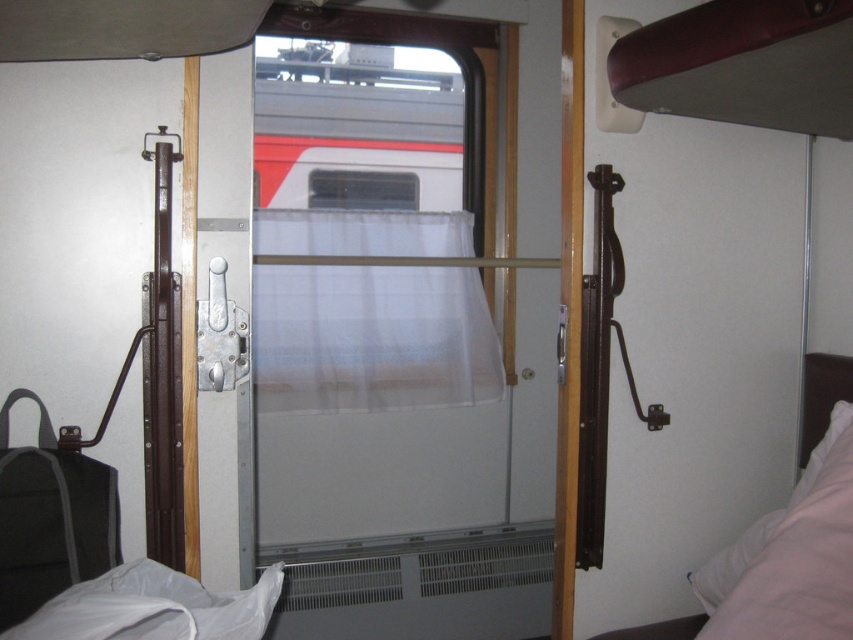
Between point (746, 588) and point (819, 365), which one is positioned behind?

Point (819, 365)

In the scene shown: Is white soft pillow at lower right to the right of white soft bed at right from the viewer's perspective?

Incorrect, white soft pillow at lower right is not on the right side of white soft bed at right.

Which is in front, point (837, 570) or point (804, 440)?

Positioned in front is point (837, 570).

In order to click on white soft pillow at lower right in this screenshot , I will do `click(790, 556)`.

Can you confirm if white sheer curtain at center is smaller than white soft pillow at lower right?

Actually, white sheer curtain at center might be larger than white soft pillow at lower right.

The height and width of the screenshot is (640, 853). What do you see at coordinates (370, 339) in the screenshot?
I see `white sheer curtain at center` at bounding box center [370, 339].

Find the location of `white sheer curtain at center`. white sheer curtain at center is located at coordinates (370, 339).

Find the location of a particular element. This screenshot has height=640, width=853. white sheer curtain at center is located at coordinates (370, 339).

Who is lower down, white soft pillow at lower right or transparent plastic window at center?

Positioned lower is white soft pillow at lower right.

Is white soft pillow at lower right closer to the viewer compared to transparent plastic window at center?

Yes, white soft pillow at lower right is in front of transparent plastic window at center.

Is point (722, 612) positioned in front of point (384, 179)?

That is True.

Where is `white soft pillow at lower right`? The image size is (853, 640). white soft pillow at lower right is located at coordinates (790, 556).